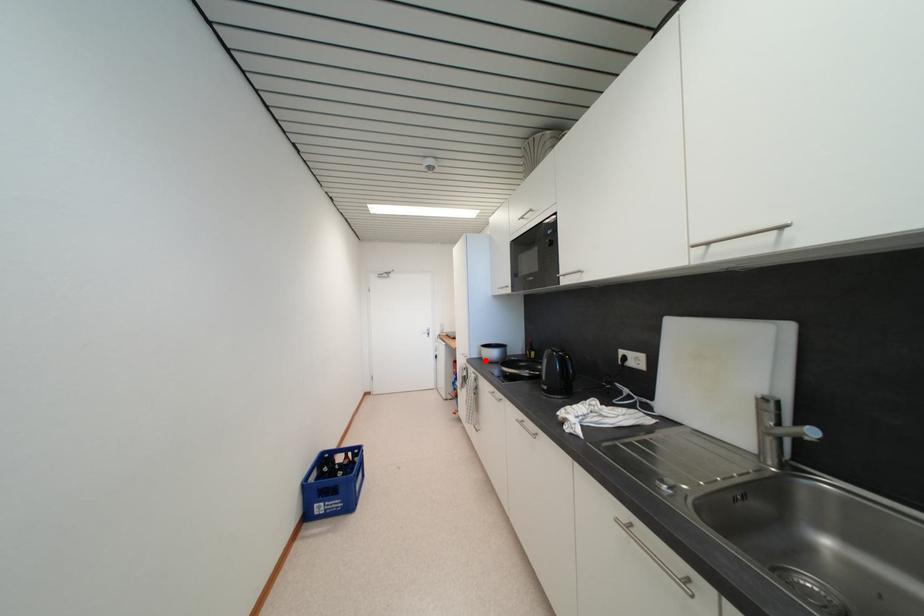
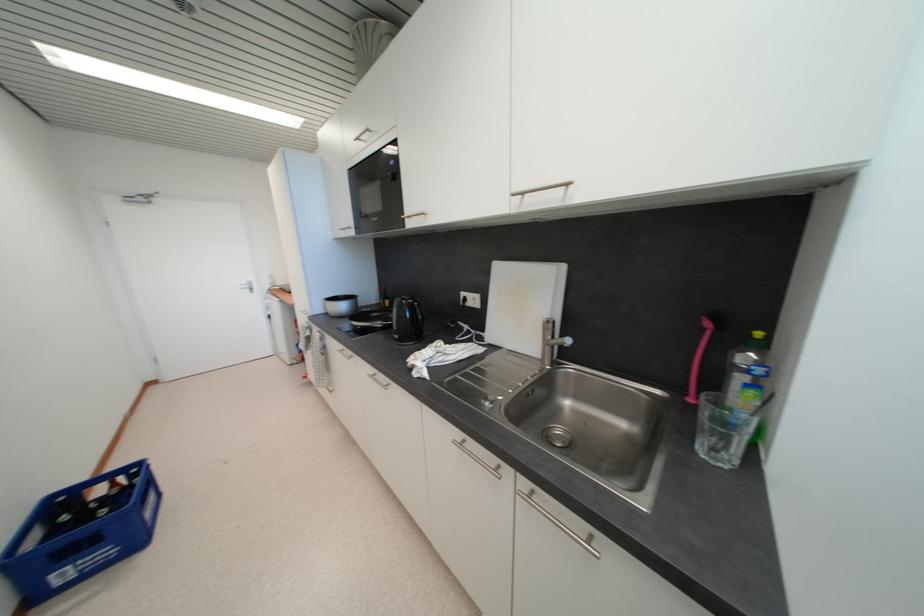
Locate, in the second image, the point that corresponds to the highlighted location in the first image.

(332, 315)